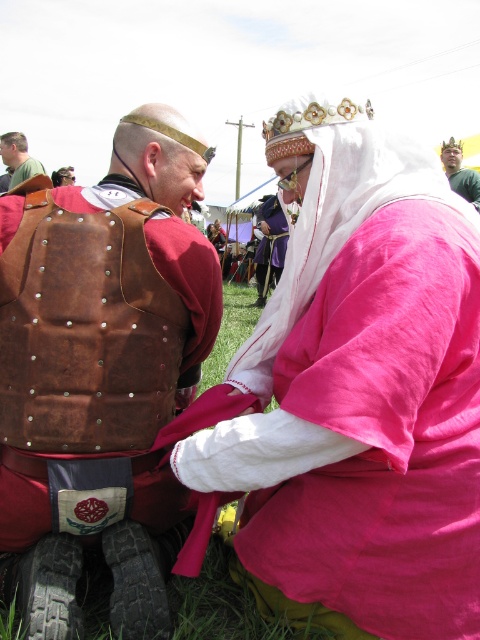
Question: Does pink cotton robe at center have a greater width compared to light brown leather vest at left?

Choices:
 (A) no
 (B) yes

Answer: (B)

Question: Which point is farther to the camera?

Choices:
 (A) light brown leather vest at left
 (B) green fabric headband at upper center

Answer: (B)

Question: Based on their relative distances, which object is farther from the brown leather vest at center?

Choices:
 (A) pink cotton robe at center
 (B) light brown leather vest at left
 (C) leather armor at center

Answer: (C)

Question: Which object appears closest to the camera in this image?

Choices:
 (A) brown leather vest at center
 (B) pink cotton robe at center
 (C) green fabric headband at upper center

Answer: (B)

Question: Is leather armor at center behind light brown leather vest at left?

Choices:
 (A) no
 (B) yes

Answer: (B)

Question: From the image, what is the correct spatial relationship of brown leather vest at center in relation to light brown leather vest at left?

Choices:
 (A) above
 (B) below

Answer: (B)